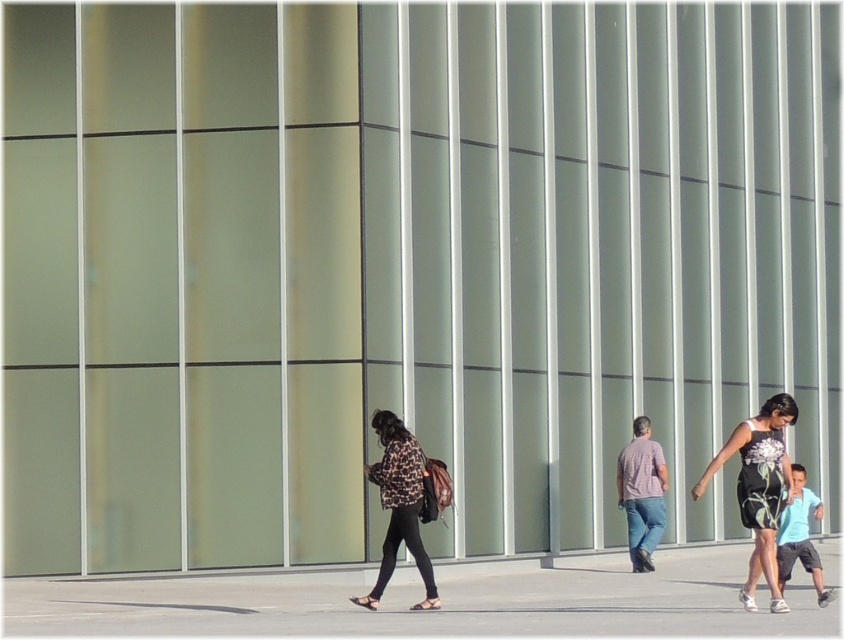
Question: Does gray concrete pavement at center appear under light blue t-shirt at center-right?

Choices:
 (A) yes
 (B) no

Answer: (A)

Question: Is gray concrete pavement at center smaller than light blue t-shirt at center-right?

Choices:
 (A) no
 (B) yes

Answer: (A)

Question: Which point is closer to the camera?

Choices:
 (A) (794, 502)
 (B) (771, 516)
 (C) (560, 614)

Answer: (B)

Question: Which of the following is the farthest from the observer?

Choices:
 (A) (737, 442)
 (B) (500, 589)

Answer: (B)

Question: Which point appears farthest from the camera in this image?

Choices:
 (A) (782, 568)
 (B) (572, 632)
 (C) (377, 422)

Answer: (A)

Question: Does black floral dress at right appear under leopard print jacket at center?

Choices:
 (A) yes
 (B) no

Answer: (B)